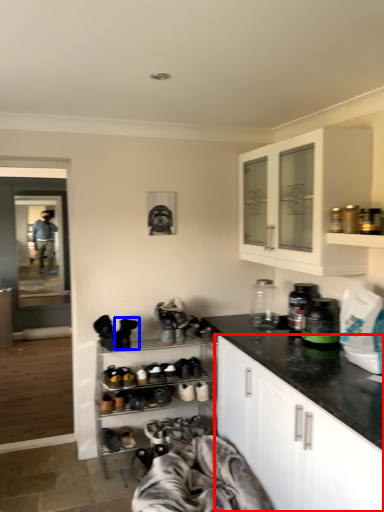
Question: Which point is further to the camera, cabinetry (highlighted by a red box) or footwear (highlighted by a blue box)?

Choices:
 (A) cabinetry
 (B) footwear

Answer: (B)